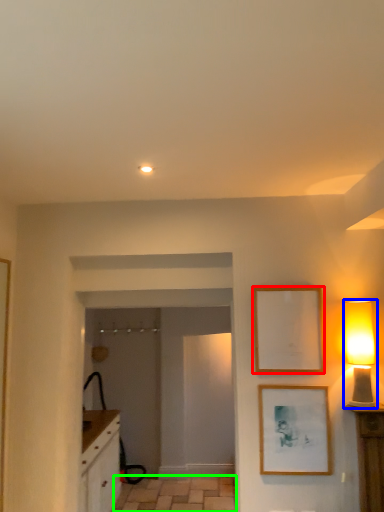
Question: Which object is positioned farthest from picture frame (highlighted by a red box)? Select from table lamp (highlighted by a blue box) and tile (highlighted by a green box).

Choices:
 (A) table lamp
 (B) tile

Answer: (B)